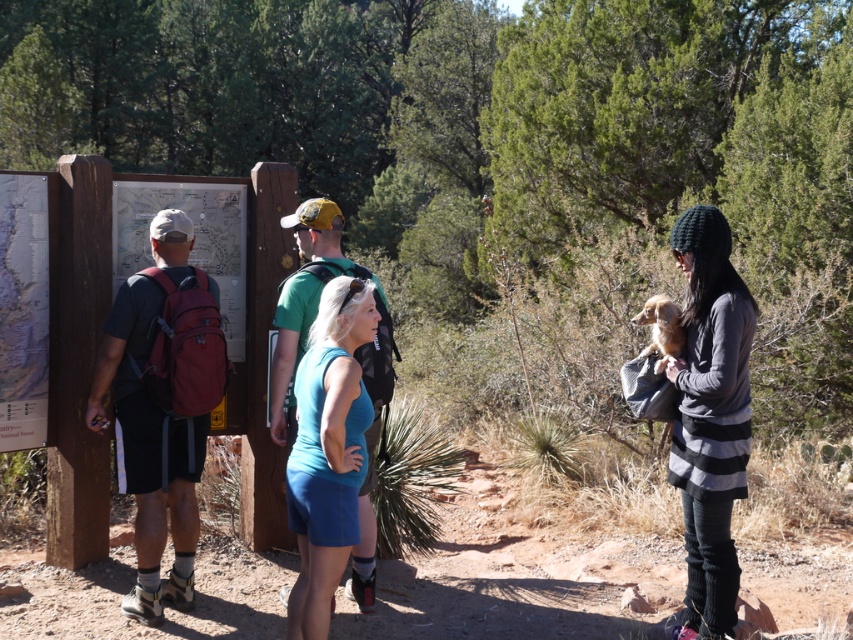
Question: Which point appears farthest from the camera in this image?

Choices:
 (A) (149, 426)
 (B) (686, 481)
 (C) (306, 556)

Answer: (A)

Question: Is matte red backpack at left further to the viewer compared to blue fabric tank top at center?

Choices:
 (A) yes
 (B) no

Answer: (A)

Question: Can you confirm if knitted gray sweater at right is bigger than blue fabric tank top at center?

Choices:
 (A) yes
 (B) no

Answer: (A)

Question: Can you confirm if matte red backpack at left is smaller than knitted gray sweater at right?

Choices:
 (A) no
 (B) yes

Answer: (A)

Question: Which point appears farthest from the camera in this image?

Choices:
 (A) (340, 332)
 (B) (703, 588)
 (C) (206, 371)

Answer: (C)

Question: Among these points, which one is farthest from the camera?

Choices:
 (A) (311, 467)
 (B) (746, 413)
 (C) (202, 296)

Answer: (C)